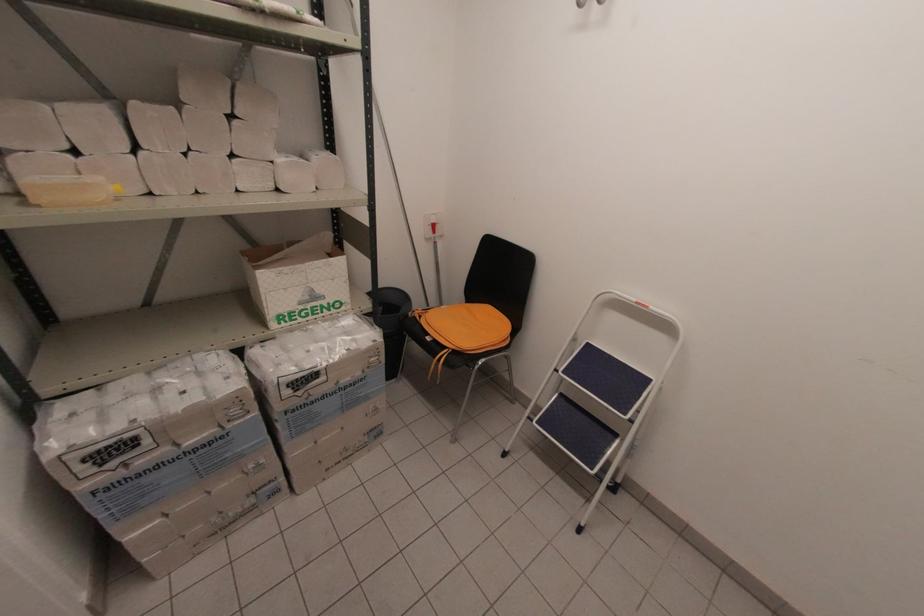
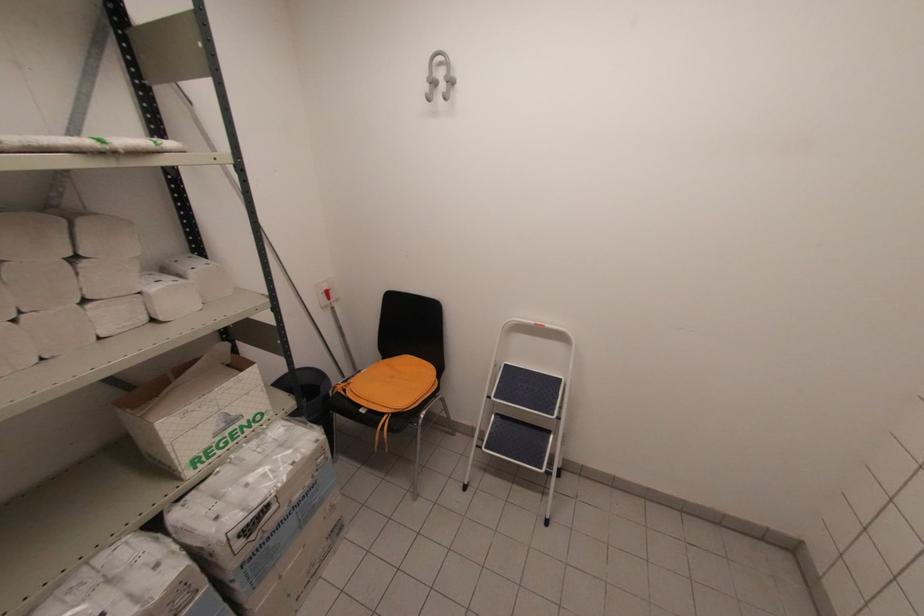
Question: The camera is either moving clockwise (left) or counter-clockwise (right) around the object. The first image is from the beginning of the video and the second image is from the end. Is the camera moving left or right when shooting the video?

Choices:
 (A) Left
 (B) Right

Answer: (A)